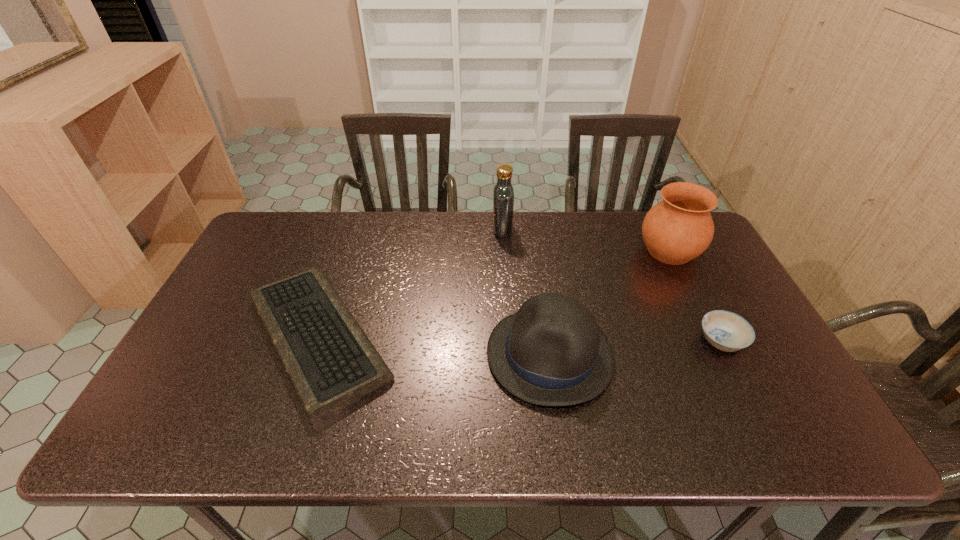
Find the location of a particular element. object at the near left corner is located at coordinates point(330,361).

The height and width of the screenshot is (540, 960). In order to click on object that is at the far right corner in this screenshot , I will do `click(679, 228)`.

I want to click on vacant space at the far edge of the desktop, so click(x=578, y=212).

Identify the location of vacant position at the near edge of the desktop. (240, 446).

This screenshot has width=960, height=540. I want to click on vacant area at the left edge, so click(249, 318).

In the image, there is a desktop. Where is `free region at the right edge`? This screenshot has width=960, height=540. free region at the right edge is located at coordinates (704, 260).

Where is `free spot at the far left corner of the desktop`? Image resolution: width=960 pixels, height=540 pixels. free spot at the far left corner of the desktop is located at coordinates (267, 245).

The image size is (960, 540). What are the coordinates of `vacant area between the pottery and the vodka` in the screenshot? It's located at (586, 240).

Find the location of a particular element. Image resolution: width=960 pixels, height=540 pixels. empty space between the third shortest object and the leftmost object is located at coordinates (434, 346).

Find the location of a particular element. empty location between the vodka and the leftmost object is located at coordinates (410, 283).